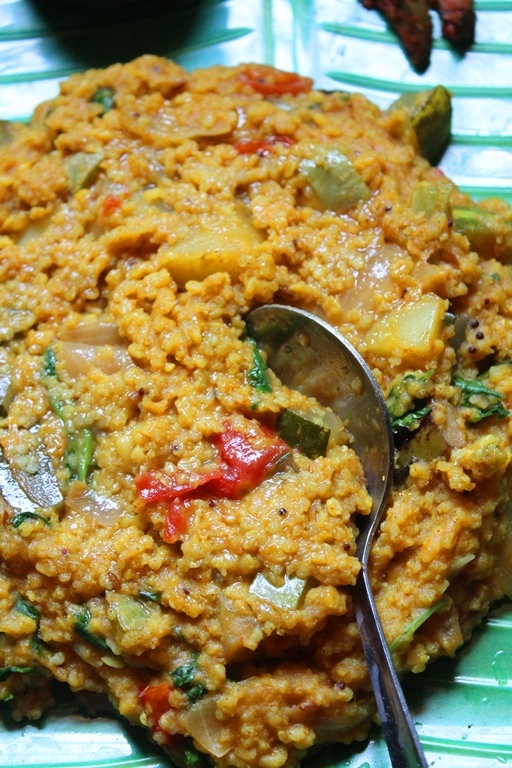
Find the location of a particular element. spoon is located at coordinates (349, 389).